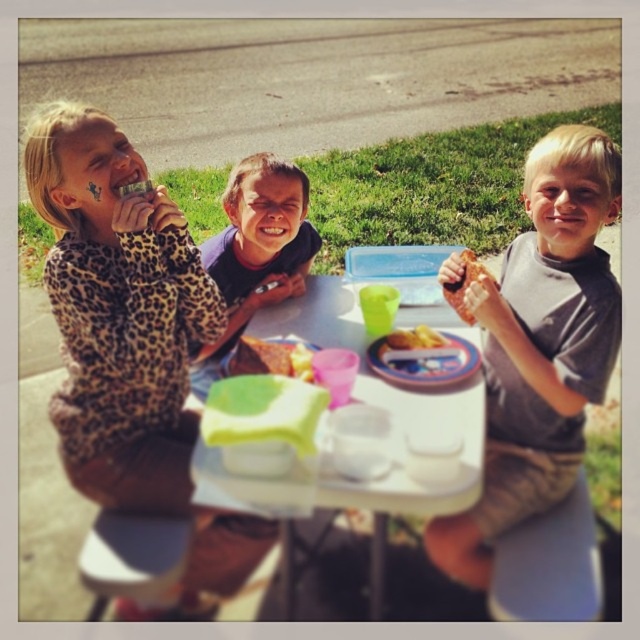
Can you confirm if gray/white t-shirt at right is positioned to the right of brown crumbly bread at right?

Indeed, gray/white t-shirt at right is positioned on the right side of brown crumbly bread at right.

Is gray/white t-shirt at right shorter than brown crumbly bread at right?

No, gray/white t-shirt at right is not shorter than brown crumbly bread at right.

Does point (490, 330) come closer to viewer compared to point (464, 282)?

Yes, it is.

At what (x,y) coordinates should I click in order to perform the action: click on gray/white t-shirt at right. Please return your answer as a coordinate pair (x, y). Looking at the image, I should click on (541, 344).

Is gray/white t-shirt at right thinner than yellow matte cake at center?

No.

Does gray/white t-shirt at right have a lesser height compared to yellow matte cake at center?

No, gray/white t-shirt at right is not shorter than yellow matte cake at center.

Locate an element on the screen. This screenshot has width=640, height=640. gray/white t-shirt at right is located at coordinates (541, 344).

Is leopard print shirt at upper left thinner than gray/white t-shirt at right?

No.

Based on the photo, does leopard print shirt at upper left appear under gray/white t-shirt at right?

No, leopard print shirt at upper left is not below gray/white t-shirt at right.

Locate an element on the screen. The height and width of the screenshot is (640, 640). leopard print shirt at upper left is located at coordinates (118, 312).